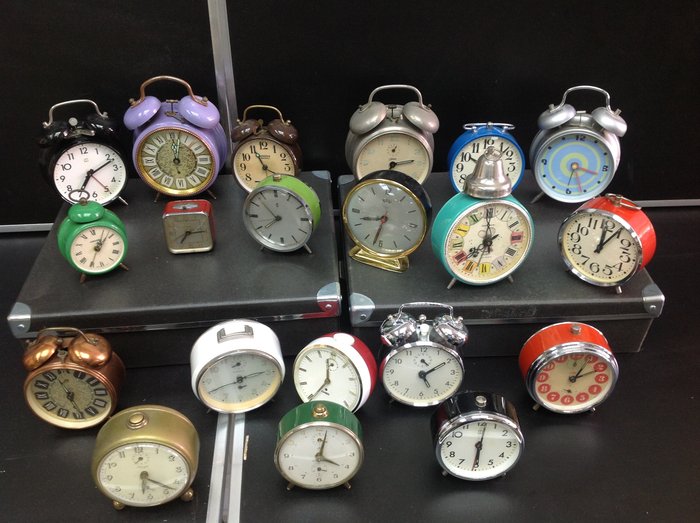
Image resolution: width=700 pixels, height=523 pixels. I want to click on black clock, so click(66, 136), click(410, 193), click(498, 410).